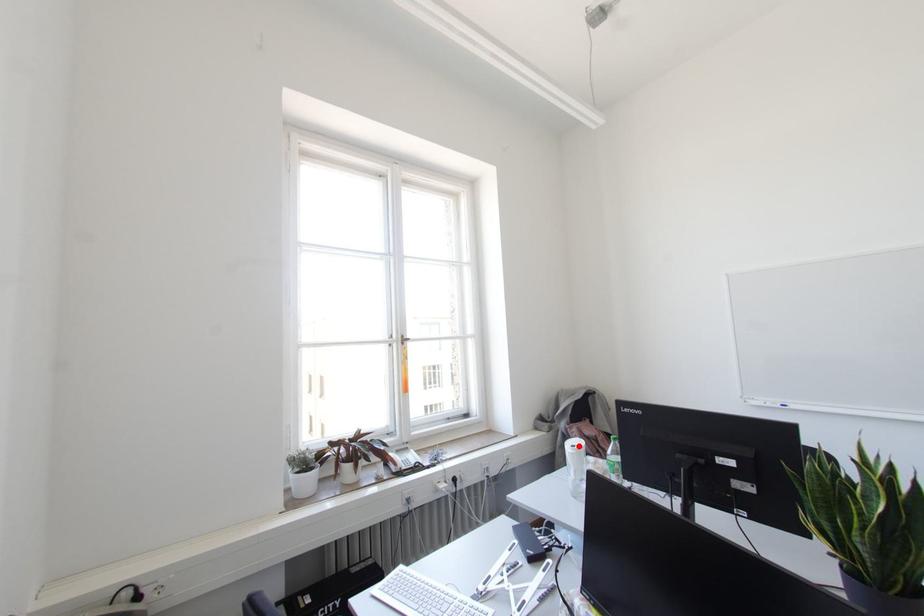
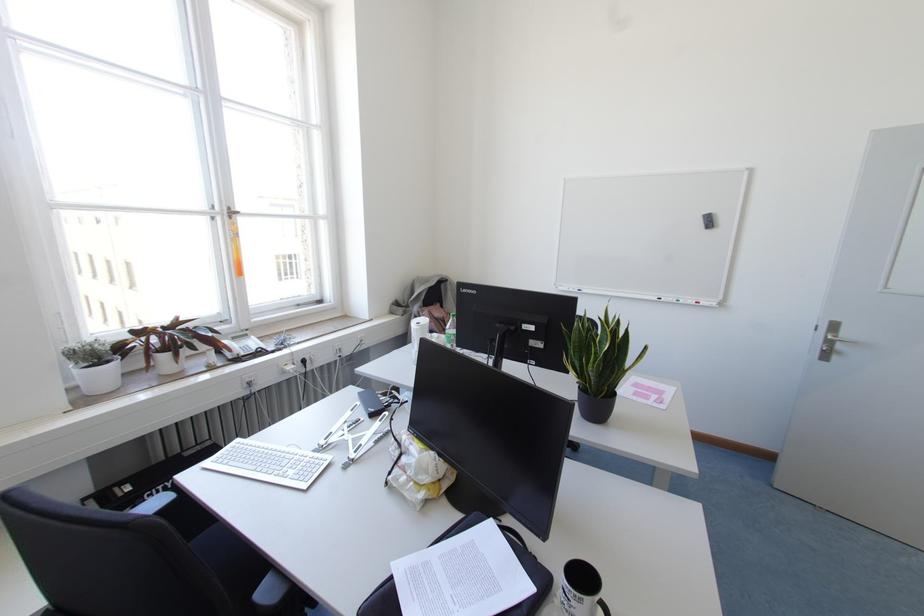
Question: A red point is marked in image1. In image2, is the corresponding 3D point closer to the camera or farther? Reply with the corresponding letter.

Choices:
 (A) The corresponding 3D point is closer.
 (B) The corresponding 3D point is farther.

Answer: (B)